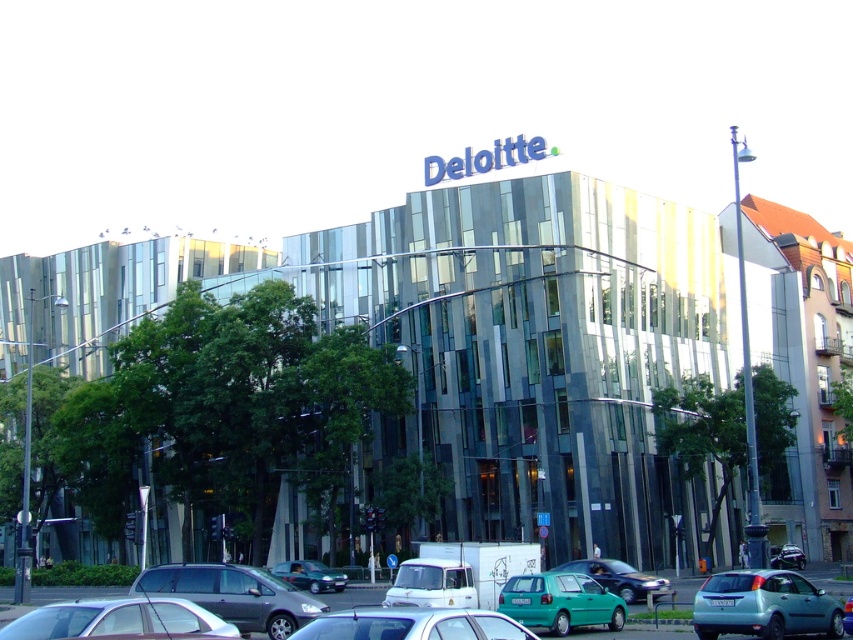
You are a delivery person who needs to park your vehicle in a spot that can accommodate your truck, which is 5 meters long. You see the matte white sedan at lower center and the metallic silver car at center. Which vehicle takes up more space in the parking area?

The matte white sedan at lower center is larger in size than the metallic silver car at center, so it takes up more space in the parking area.

You are a delivery driver who needs to park your 15 feet long truck between the metallic blue sedan at center and the metallic green car at center on the street. Can you fit your truck there without overlapping either vehicle?

The distance between the metallic blue sedan at center and the metallic green car at center is 53.30 feet. Since your truck is only 15 feet long, there is sufficient space to park it between them without overlapping either vehicle.

You are standing on the sidewalk in front of the Deloitte building and notice two points marked on the building. The first point is at coordinate point [461,614] and the second is at point [776,552]. Which of these points is closer to you?

Point [461,614] is closer to the viewer than point [776,552].